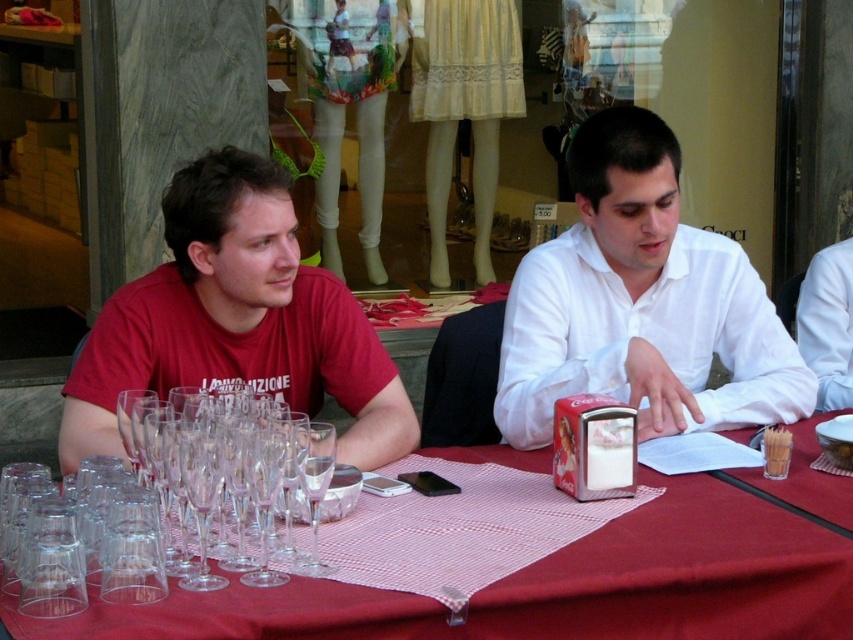
Question: Is matte red t-shirt at left to the right of clear glass wine glass at center from the viewer's perspective?

Choices:
 (A) no
 (B) yes

Answer: (A)

Question: Is matte red t-shirt at left smaller than clear glass wine glass at center?

Choices:
 (A) yes
 (B) no

Answer: (B)

Question: Which point is farther to the camera?

Choices:
 (A) red fabric tablecloth at center
 (B) matte red t-shirt at left
 (C) white smooth shirt at center
 (D) clear glass wine glass at center

Answer: (C)

Question: Which point is farther to the camera?

Choices:
 (A) red fabric tablecloth at center
 (B) white smooth shirt at center
 (C) matte red t-shirt at left
 (D) clear glass wine glass at center

Answer: (B)

Question: Does red fabric tablecloth at center have a larger size compared to white smooth shirt at center?

Choices:
 (A) yes
 (B) no

Answer: (A)

Question: Which of the following is the farthest from the observer?

Choices:
 (A) red fabric tablecloth at center
 (B) clear glass wine glass at center
 (C) matte red t-shirt at left
 (D) white smooth shirt at center

Answer: (D)